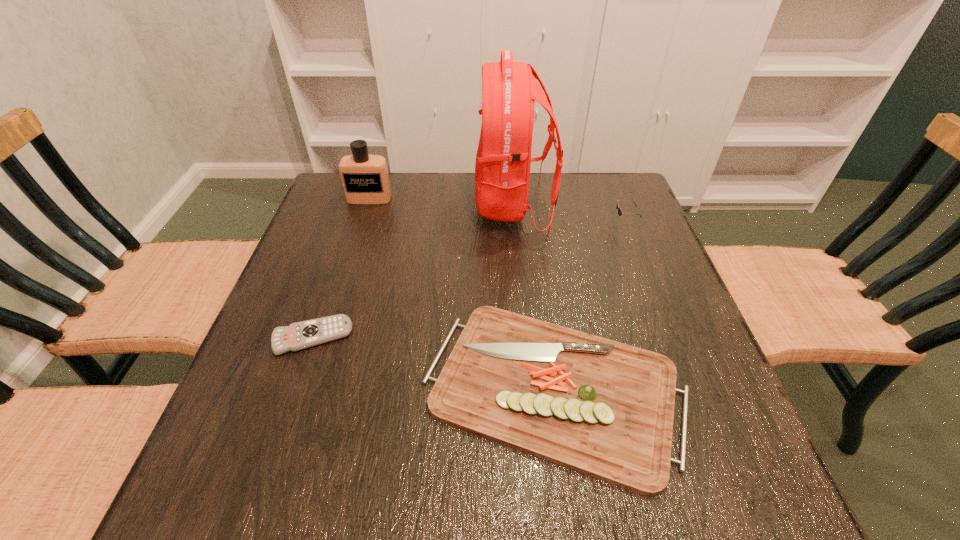
At what (x,y) coordinates should I click in order to perform the action: click on backpack. Please return your answer as a coordinate pair (x, y). Looking at the image, I should click on (509, 89).

You are a GUI agent. You are given a task and a screenshot of the screen. Output one action in this format:
    pyautogui.click(x=<x>, y=<y>)
    Task: Click on the fourth shortest object
    This screenshot has height=540, width=960.
    Given the screenshot: What is the action you would take?
    pyautogui.click(x=365, y=180)

The image size is (960, 540). I want to click on sunglasses, so pyautogui.click(x=620, y=212).

Locate an element on the screen. This screenshot has height=540, width=960. the second shortest object is located at coordinates (600, 407).

Image resolution: width=960 pixels, height=540 pixels. Identify the location of the shortest object. (297, 336).

At what (x,y) coordinates should I click in order to perform the action: click on free space located 0.190m on the main compartment of the tallest object. Please return your answer as a coordinate pair (x, y). Looking at the image, I should click on (406, 206).

Identify the location of vacant space located 0.390m on the main compartment of the tallest object. Image resolution: width=960 pixels, height=540 pixels. (334, 206).

This screenshot has width=960, height=540. I want to click on free space located on the main compartment of the tallest object, so click(457, 206).

You are a GUI agent. You are given a task and a screenshot of the screen. Output one action in this format:
    pyautogui.click(x=<x>, y=<y>)
    Task: Click on the blank area located 0.300m on the front label of the second tallest object
    The height and width of the screenshot is (540, 960).
    Given the screenshot: What is the action you would take?
    pyautogui.click(x=344, y=280)

Locate an element on the screen. The width and height of the screenshot is (960, 540). vacant space located in front of the lenses of the sunglasses is located at coordinates (579, 223).